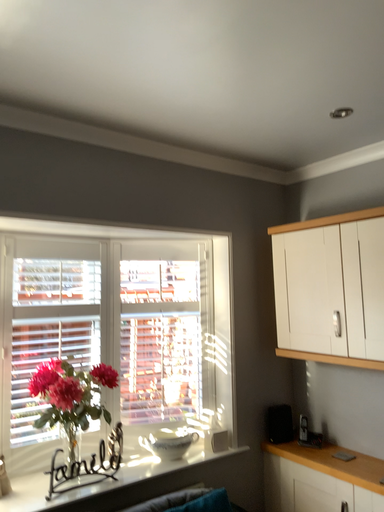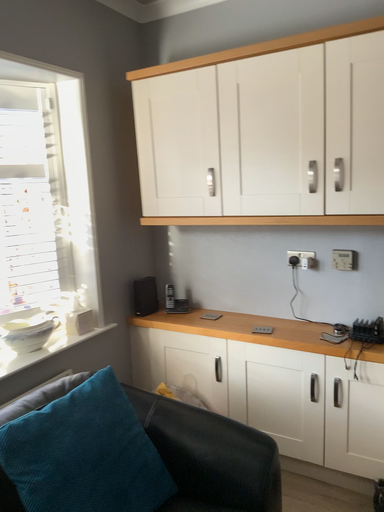
Question: How did the camera likely rotate when shooting the video?

Choices:
 (A) rotated upward
 (B) rotated downward

Answer: (B)